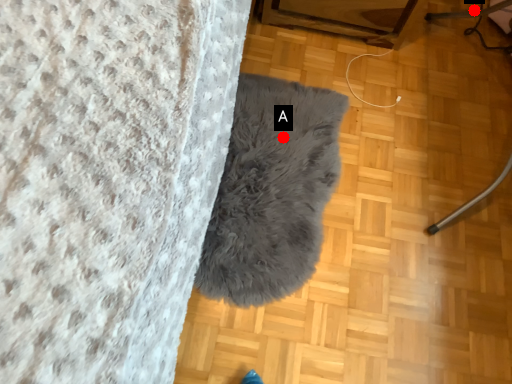
Question: Two points are circled on the image, labeled by A and B beside each circle. Which point is closer to the camera taking this photo?

Choices:
 (A) A is closer
 (B) B is closer

Answer: (A)